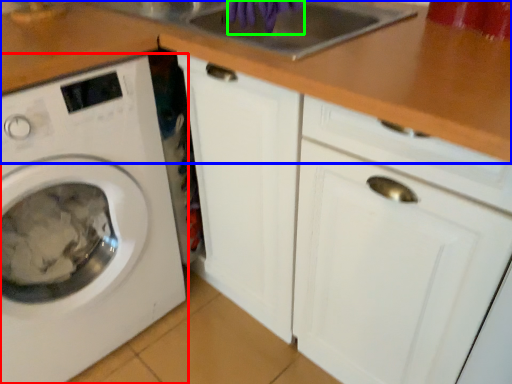
Question: Based on their relative distances, which object is farther from washing machine (highlighted by a red box)? Choose from counter top (highlighted by a blue box) and hand (highlighted by a green box).

Choices:
 (A) counter top
 (B) hand

Answer: (B)